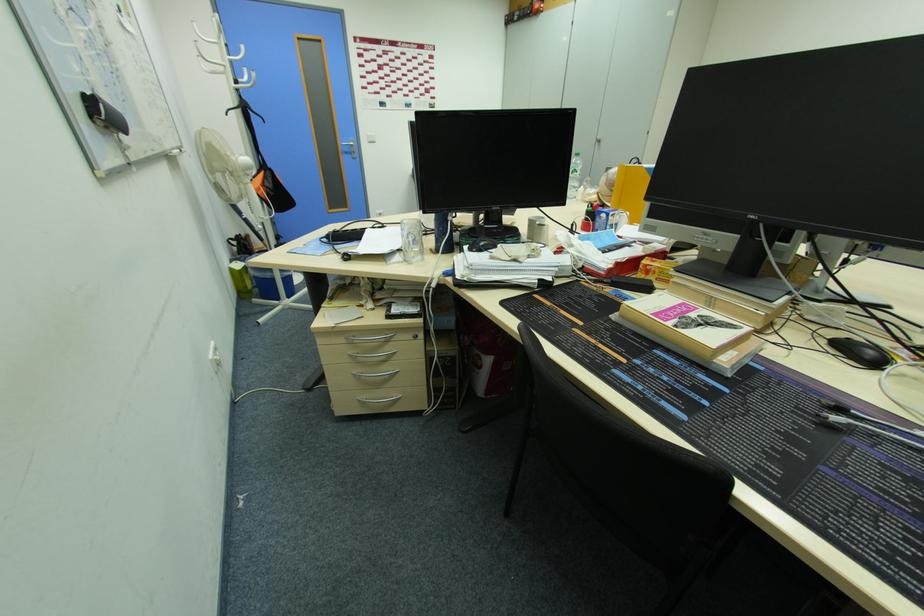
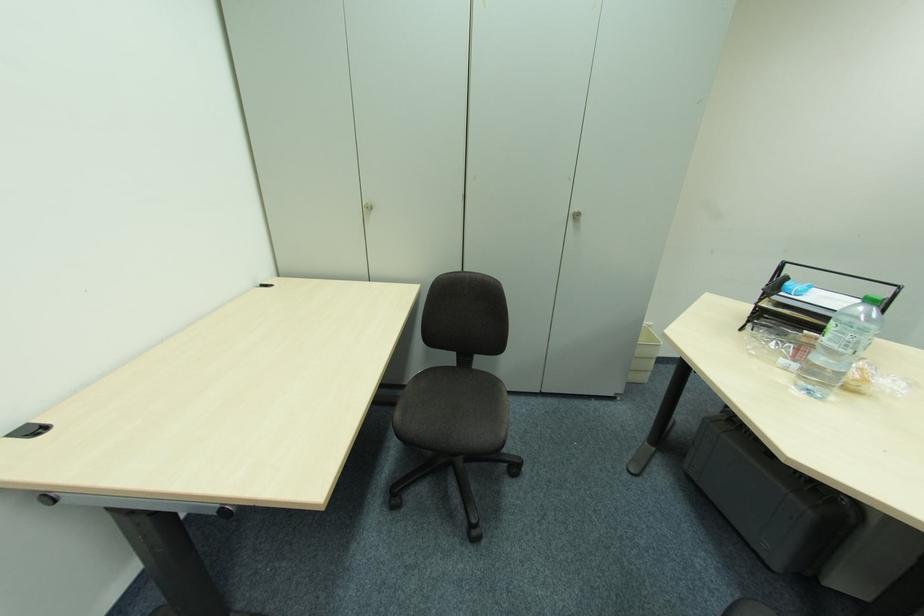
Find the pixel in the second image that matches point (600, 145) in the first image.

(574, 219)